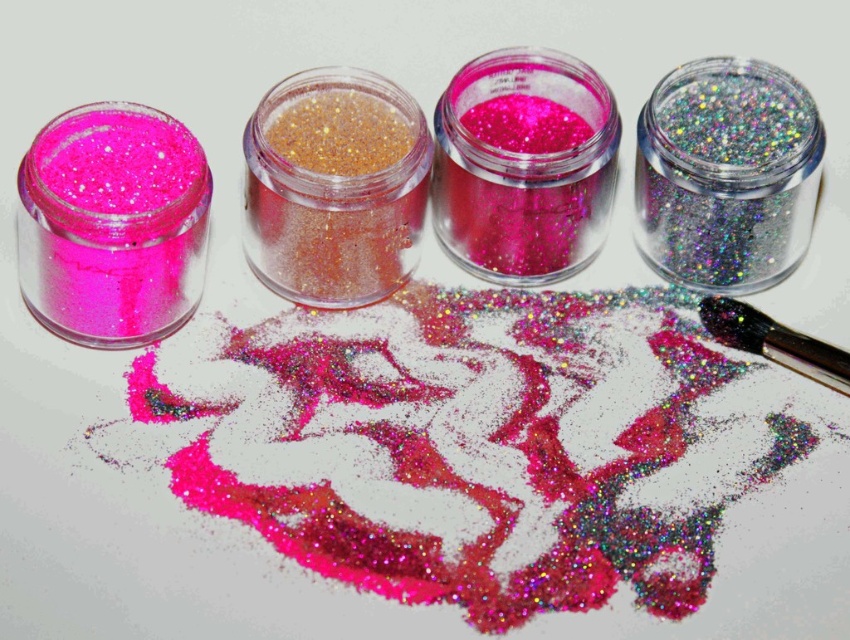
Question: Which object is closer to the camera taking this photo?

Choices:
 (A) gold glitter powder at center
 (B) metallic silver brush at upper right

Answer: (A)

Question: Is gold glitter powder at center positioned at the back of metallic silver brush at upper right?

Choices:
 (A) yes
 (B) no

Answer: (B)

Question: Does gold glitter powder at center have a greater width compared to metallic silver brush at upper right?

Choices:
 (A) yes
 (B) no

Answer: (A)

Question: Can you confirm if gold glitter powder at center is positioned below metallic silver brush at upper right?

Choices:
 (A) no
 (B) yes

Answer: (A)